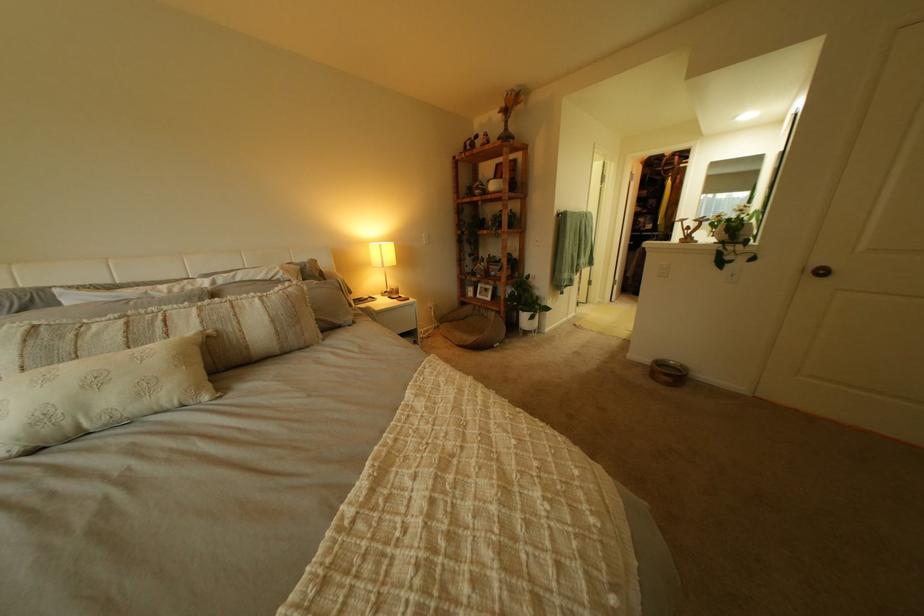
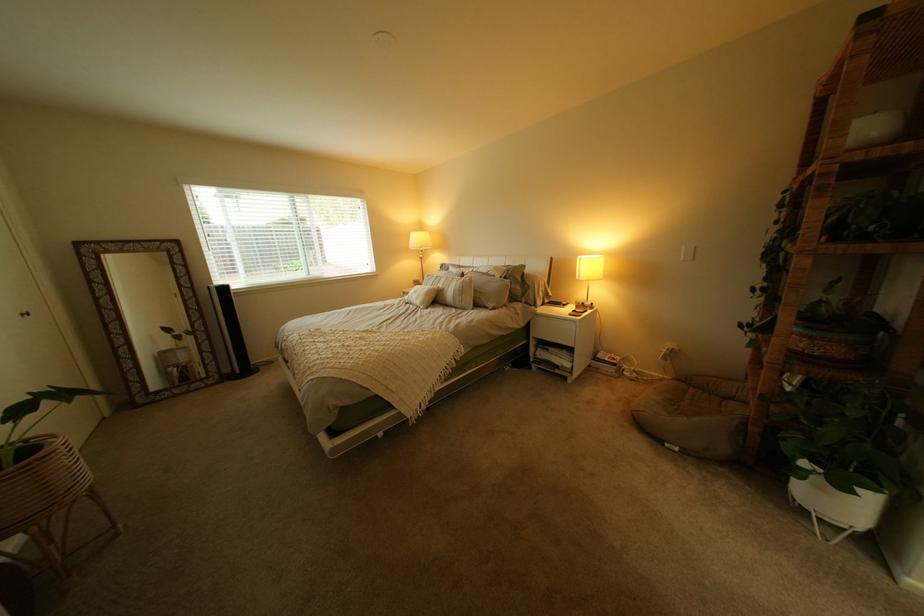
Find the pixel in the second image that matches pixel 541 334 in the first image.

(821, 512)